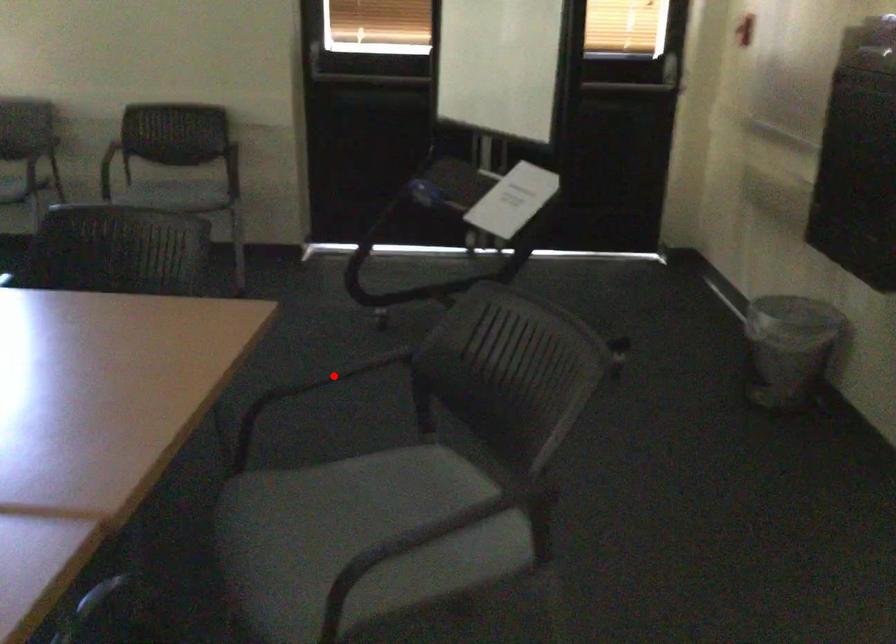
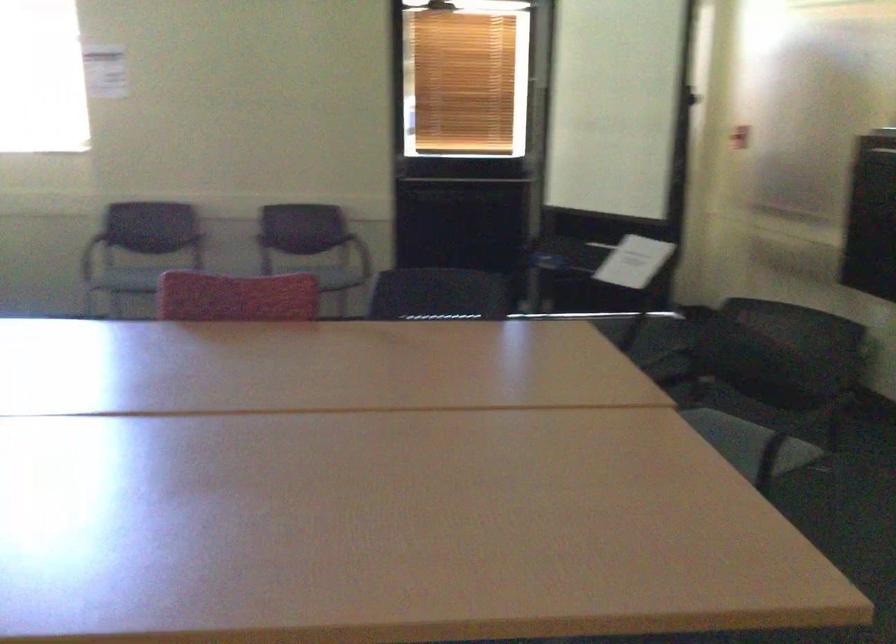
Question: I am providing you with two images of the same scene from different viewpoints. A red point is marked on the first image. Can you still see the location of the red point in image 2?

Choices:
 (A) Yes
 (B) No

Answer: (B)